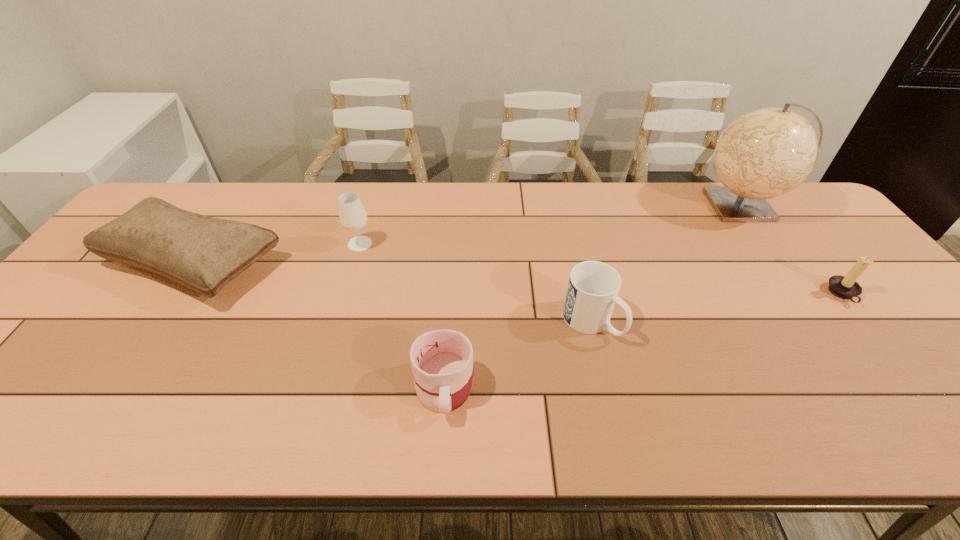
Identify the location of object at the left edge. This screenshot has width=960, height=540. (203, 253).

I want to click on globe at the right edge, so click(x=768, y=152).

At what (x,y) coordinates should I click in order to perform the action: click on candle holder at the right edge. Please return your answer as a coordinate pair (x, y). This screenshot has height=540, width=960. Looking at the image, I should click on (845, 287).

Where is `object at the far left corner`? The image size is (960, 540). object at the far left corner is located at coordinates (203, 253).

Locate an element on the screen. object that is positioned at the far right corner is located at coordinates (768, 152).

Identify the location of free location at the far edge of the desktop. (622, 194).

Find the location of `vacant point at the near edge`. vacant point at the near edge is located at coordinates (124, 409).

You are a GUI agent. You are given a task and a screenshot of the screen. Output one action in this format:
    pyautogui.click(x=<x>, y=<y>)
    Task: Click on the vacant space at the left edge of the desktop
    The height and width of the screenshot is (540, 960).
    Given the screenshot: What is the action you would take?
    pyautogui.click(x=80, y=339)

Locate an element on the screen. vacant area at the near left corner of the desktop is located at coordinates (0, 430).

Image resolution: width=960 pixels, height=540 pixels. Find the location of `free spot at the far right corner of the desktop`. free spot at the far right corner of the desktop is located at coordinates (813, 210).